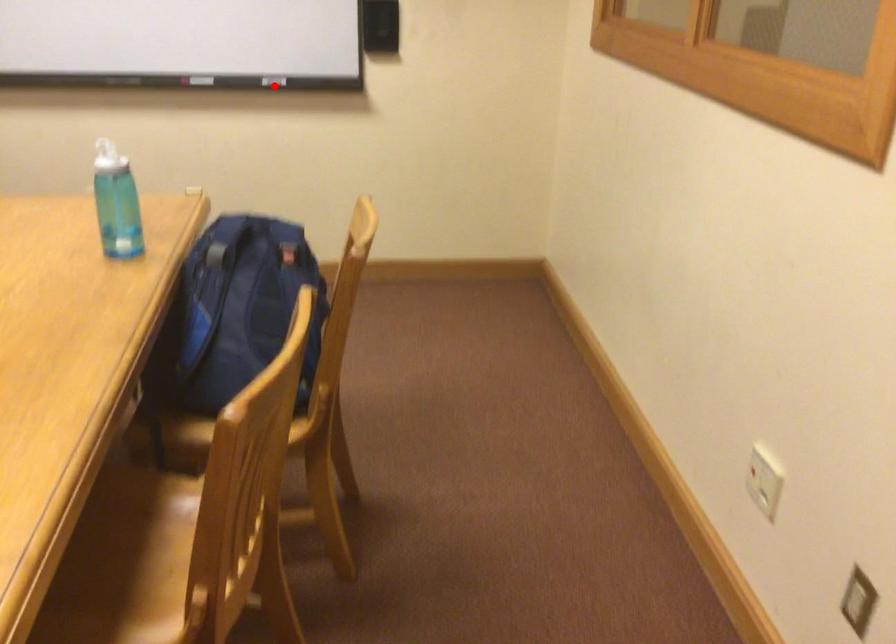
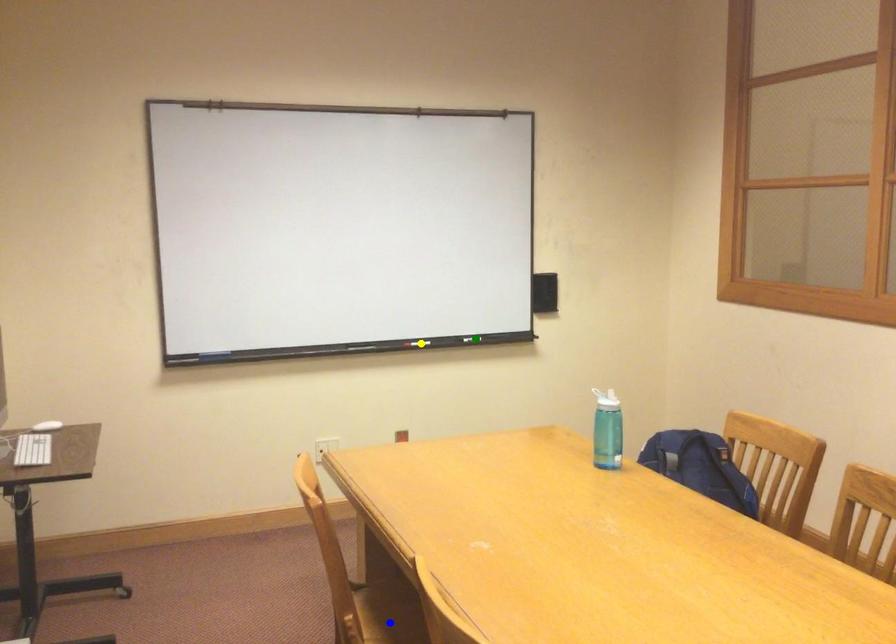
Question: I am providing you with two images of the same scene from different viewpoints. A red point is marked on the first image. You are given multiple points on the second image. Which point in image 2 is actually the same real-world point as the red point in image 1?

Choices:
 (A) blue point
 (B) green point
 (C) yellow point

Answer: (B)